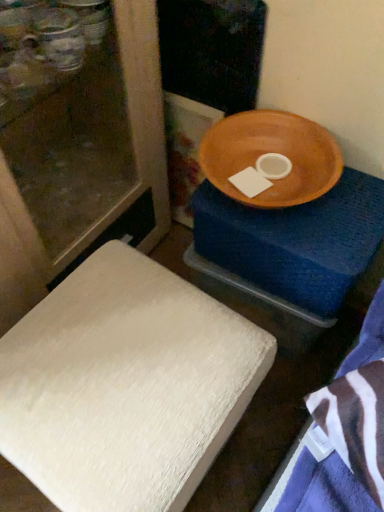
At what (x,y) coordinates should I click in order to perform the action: click on free location above wooden bowl at upper right (from a real-world perspective). Please return your answer as a coordinate pair (x, y). Image resolution: width=384 pixels, height=512 pixels. Looking at the image, I should click on [x=288, y=184].